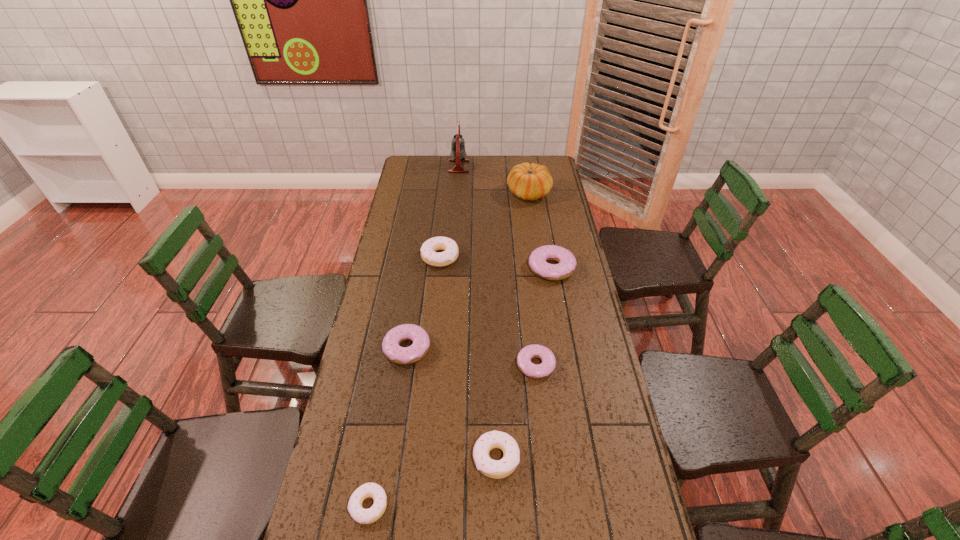
The height and width of the screenshot is (540, 960). I want to click on free area in between the biggest white doughnut and the smallest pink doughnut, so click(x=488, y=310).

The image size is (960, 540). What are the coordinates of `unoccupied area between the third doughnut from right to left and the bell` in the screenshot? It's located at (477, 312).

Identify the location of object that is the fifth closest to the biggest white doughnut. (458, 153).

Where is `object that ranks as the fifth closest to the bell`? object that ranks as the fifth closest to the bell is located at coordinates (537, 371).

Locate an element on the screen. This screenshot has width=960, height=540. doughnut that is the third nearest to the leftmost pink doughnut is located at coordinates (438, 259).

Identify which doughnut is the second nearest to the gourd. Please provide its 2D coordinates. Your answer should be formatted as a tuple, i.e. [(x, y)], where the tuple contains the x and y coordinates of a point satisfying the conditions above.

[(438, 259)]

Select which white doughnut is the third closest to the second farthest object. Please provide its 2D coordinates. Your answer should be formatted as a tuple, i.e. [(x, y)], where the tuple contains the x and y coordinates of a point satisfying the conditions above.

[(368, 490)]

The height and width of the screenshot is (540, 960). I want to click on white doughnut identified as the second closest to the second smallest white doughnut, so click(438, 259).

Identify the location of pink doughnut that is the second closest to the tallest object. (392, 350).

Where is `the third closest pink doughnut to the second farthest object`? This screenshot has width=960, height=540. the third closest pink doughnut to the second farthest object is located at coordinates (537, 371).